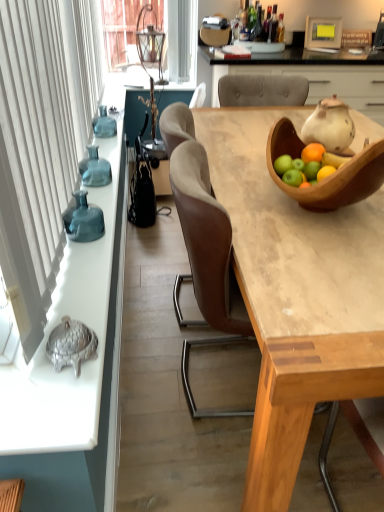
This screenshot has width=384, height=512. In order to click on vacant space in front of translucent glass vase at left, the 2th vase from the bottom in this screenshot , I will do `click(97, 194)`.